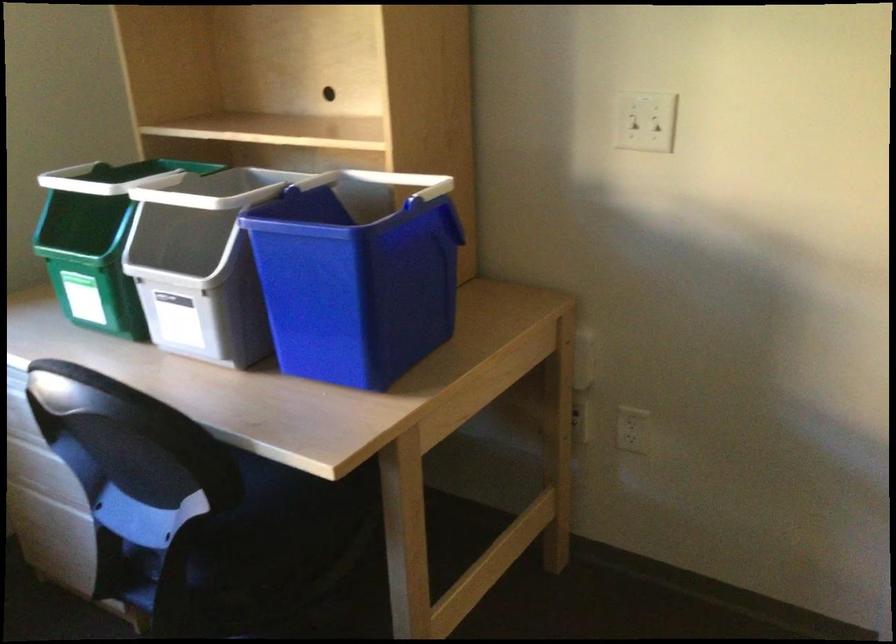
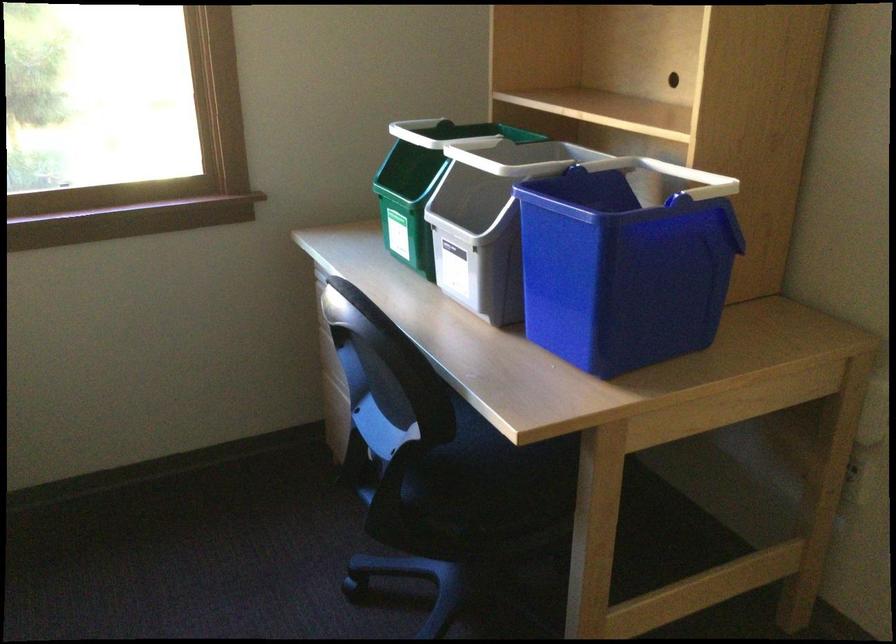
Where in the second image is the point corresponding to (95,239) from the first image?

(421, 184)